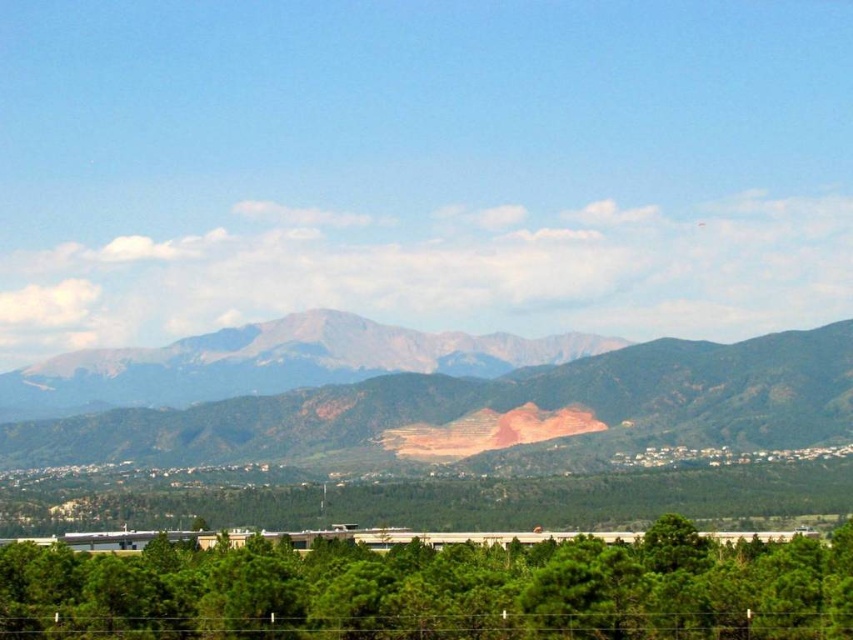
Question: Does green leafy tree at lower center appear on the left side of rugged brown mountain range at center?

Choices:
 (A) yes
 (B) no

Answer: (B)

Question: Does green leafy tree at lower center appear on the left side of rugged brown mountain range at center?

Choices:
 (A) yes
 (B) no

Answer: (B)

Question: Among these objects, which one is nearest to the camera?

Choices:
 (A) rugged brown mountain range at center
 (B) green leafy tree at lower center

Answer: (B)

Question: Does green leafy tree at lower center have a lesser width compared to rugged brown mountain range at center?

Choices:
 (A) yes
 (B) no

Answer: (A)

Question: Which of the following is the farthest from the observer?

Choices:
 (A) (242, 397)
 (B) (651, 595)

Answer: (A)